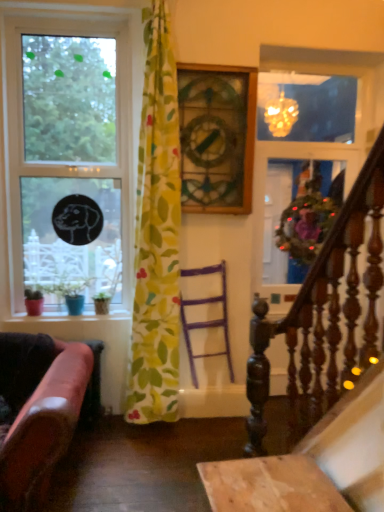
Find the location of a particular element. blank space situated above clear glass window at left (from a real-world perspective) is located at coordinates (66, 17).